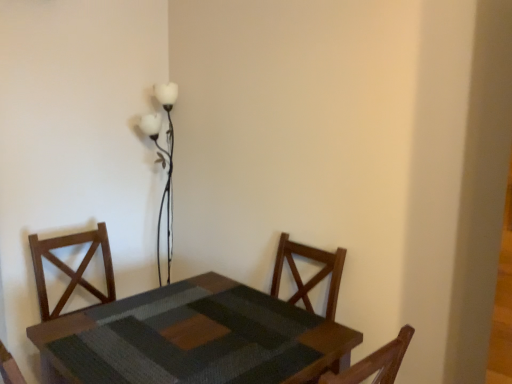
What do you see at coordinates (190, 338) in the screenshot?
I see `wooden textured table at center` at bounding box center [190, 338].

Measure the distance between wooden textured table at center and camera.

A distance of 3.77 feet exists between wooden textured table at center and camera.

What is the approximate width of wooden textured table at center?

wooden textured table at center is 32.09 inches wide.

Identify the location of wooden textured table at center. (190, 338).

Describe the element at coordinates (163, 162) in the screenshot. I see `white glass floor lamp at upper center` at that location.

At what (x,y) coordinates should I click in order to perform the action: click on white glass floor lamp at upper center. Please return your answer as a coordinate pair (x, y). The image size is (512, 384). Looking at the image, I should click on (163, 162).

Where is `wooden textured table at center`? Image resolution: width=512 pixels, height=384 pixels. wooden textured table at center is located at coordinates [190, 338].

Which is more to the left, white glass floor lamp at upper center or wooden textured table at center?

white glass floor lamp at upper center.

Which object is more forward, white glass floor lamp at upper center or wooden textured table at center?

wooden textured table at center is more forward.

Which is behind, point (170, 94) or point (128, 369)?

The point (170, 94) is farther.

From the image's perspective, is white glass floor lamp at upper center below wooden textured table at center?

Incorrect, from the image's perspective, white glass floor lamp at upper center is higher than wooden textured table at center.

From a real-world perspective, which is physically above, white glass floor lamp at upper center or wooden textured table at center?

white glass floor lamp at upper center.

Does white glass floor lamp at upper center have a greater width compared to wooden textured table at center?

No.

Considering the relative sizes of white glass floor lamp at upper center and wooden textured table at center in the image provided, is white glass floor lamp at upper center taller than wooden textured table at center?

Yes, white glass floor lamp at upper center is taller than wooden textured table at center.

Considering the relative sizes of white glass floor lamp at upper center and wooden textured table at center in the image provided, is white glass floor lamp at upper center smaller than wooden textured table at center?

Correct, white glass floor lamp at upper center occupies less space than wooden textured table at center.

Is white glass floor lamp at upper center not inside wooden textured table at center?

Yes, white glass floor lamp at upper center is located beyond the bounds of wooden textured table at center.

Is white glass floor lamp at upper center with wooden textured table at center?

No.

Is white glass floor lamp at upper center facing towards wooden textured table at center?

No, white glass floor lamp at upper center is not aimed at wooden textured table at center.

The height and width of the screenshot is (384, 512). Identify the location of table lamp on the left of the wooden textured table at center. (163, 162).

Which is more to the left, wooden textured table at center or white glass floor lamp at upper center?

From the viewer's perspective, white glass floor lamp at upper center appears more on the left side.

In the scene shown: Is the depth of wooden textured table at center less than that of white glass floor lamp at upper center?

Yes, wooden textured table at center is closer to the camera.

Which point is more forward, [42,380] or [153,140]?

The point [42,380] is in front.

From the image's perspective, is wooden textured table at center positioned above or below white glass floor lamp at upper center?

Based on their image positions, wooden textured table at center is located beneath white glass floor lamp at upper center.

From a real-world perspective, is wooden textured table at center physically below white glass floor lamp at upper center?

Yes.

Considering the sizes of objects wooden textured table at center and white glass floor lamp at upper center in the image provided, who is thinner, wooden textured table at center or white glass floor lamp at upper center?

With smaller width is white glass floor lamp at upper center.

Does wooden textured table at center have a greater height compared to white glass floor lamp at upper center?

No, wooden textured table at center is not taller than white glass floor lamp at upper center.

Does wooden textured table at center have a smaller size compared to white glass floor lamp at upper center?

No, wooden textured table at center is not smaller than white glass floor lamp at upper center.

Is wooden textured table at center inside or outside of white glass floor lamp at upper center?

wooden textured table at center is not inside white glass floor lamp at upper center, it's outside.

Are wooden textured table at center and white glass floor lamp at upper center making contact?

No, wooden textured table at center is not making contact with white glass floor lamp at upper center.

Is wooden textured table at center oriented away from white glass floor lamp at upper center?

wooden textured table at center does not have its back to white glass floor lamp at upper center.

The width and height of the screenshot is (512, 384). Identify the location of table below the white glass floor lamp at upper center (from the image's perspective). (190, 338).

Where is `table lamp on the left of wooden textured table at center`? The height and width of the screenshot is (384, 512). table lamp on the left of wooden textured table at center is located at coordinates (163, 162).

Where is `table in front of the white glass floor lamp at upper center`? This screenshot has width=512, height=384. table in front of the white glass floor lamp at upper center is located at coordinates (190, 338).